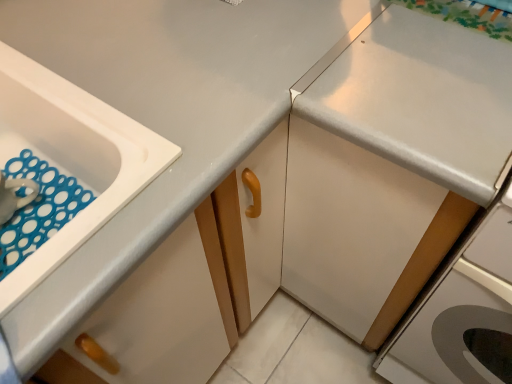
Question: Is white glossy drawer at lower left shorter than white glossy countertop at upper right?

Choices:
 (A) no
 (B) yes

Answer: (B)

Question: Can you confirm if white glossy drawer at lower left is taller than white glossy countertop at upper right?

Choices:
 (A) yes
 (B) no

Answer: (B)

Question: From a real-world perspective, is white glossy drawer at lower left below white glossy countertop at upper right?

Choices:
 (A) no
 (B) yes

Answer: (A)

Question: Does white glossy drawer at lower left lie in front of white glossy countertop at upper right?

Choices:
 (A) yes
 (B) no

Answer: (A)

Question: From the image's perspective, is white glossy drawer at lower left on top of white glossy countertop at upper right?

Choices:
 (A) yes
 (B) no

Answer: (B)

Question: From a real-world perspective, is white plastic sink at left above or below white glossy cabinet at right?

Choices:
 (A) below
 (B) above

Answer: (B)

Question: Considering their positions, is white plastic sink at left located in front of or behind white glossy cabinet at right?

Choices:
 (A) front
 (B) behind

Answer: (A)

Question: Based on their positions, is white plastic sink at left located to the left or right of white glossy cabinet at right?

Choices:
 (A) left
 (B) right

Answer: (A)

Question: Is white plastic sink at left taller or shorter than white glossy cabinet at right?

Choices:
 (A) short
 (B) tall

Answer: (A)

Question: Is white plastic sink at left to the left or to the right of white glossy drawer at lower left in the image?

Choices:
 (A) right
 (B) left

Answer: (B)

Question: Based on their sizes in the image, would you say white plastic sink at left is bigger or smaller than white glossy drawer at lower left?

Choices:
 (A) small
 (B) big

Answer: (B)

Question: Considering their positions, is white plastic sink at left located in front of or behind white glossy drawer at lower left?

Choices:
 (A) front
 (B) behind

Answer: (B)

Question: From a real-world perspective, is white plastic sink at left above or below white glossy drawer at lower left?

Choices:
 (A) above
 (B) below

Answer: (B)

Question: In the image, is white glossy drawer at lower left positioned in front of or behind white glossy countertop at upper right?

Choices:
 (A) behind
 (B) front

Answer: (B)

Question: From the image's perspective, is white glossy drawer at lower left positioned above or below white glossy countertop at upper right?

Choices:
 (A) below
 (B) above

Answer: (A)